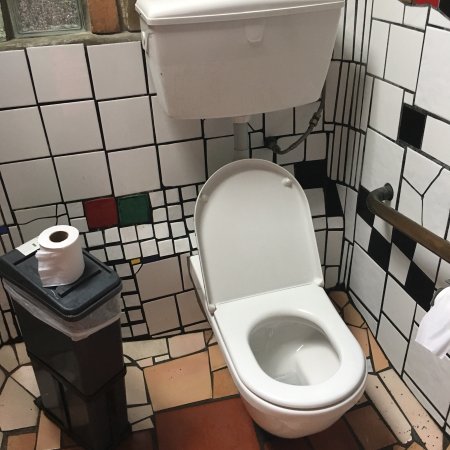
Locate an element on the screen. The height and width of the screenshot is (450, 450). space directly above toilet seat cover is located at coordinates (241, 157).